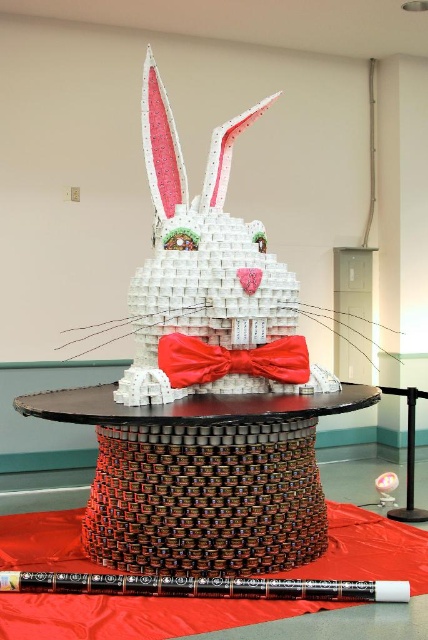
You are a delivery person who needs to place a 12 inch box on the wooden table at center without moving the shiny satin bow tie at center. Is there enough space?

The wooden table at center and shiny satin bow tie at center are 11.57 inches apart from each other. Since the box is 12 inches wide, it might not fit without overlapping the bow tie.

You are standing in front of the rabbit sculpture made from cans. You see a wooden table at center and a shiny satin bow tie at center. Which object is closer to you?

The wooden table at center is closer to the viewer than the shiny satin bow tie at center.

You are setting up a table for a party and need to place a decorative bow tie on top of the table. Given the current arrangement shown in the image, can you place the shiny satin bow tie at center on the wooden table at center without moving any other items?

The wooden table at center is located below the shiny satin bow tie at center, so the bow tie is already resting on the table. Therefore, no adjustment is needed as the shiny satin bow tie at center is already placed on the wooden table at center.